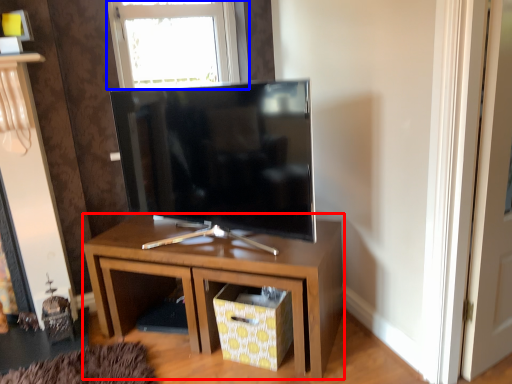
Question: Which object is closer to the camera taking this photo, nightstand (highlighted by a red box) or window (highlighted by a blue box)?

Choices:
 (A) nightstand
 (B) window

Answer: (A)